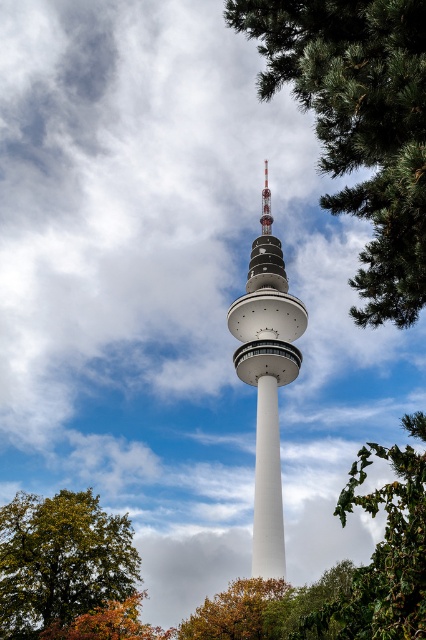
You are standing in front of the white smooth tower at center and want to find the green leafy tree at lower left. In which direction should you look?

The green leafy tree at lower left is to the left of the white smooth tower at center, so you should look to your left to find it.

You are an architect designing a new park layout. You have to place a bench between the white smooth tower at center and the autumn leaves at lower center. Which object should the bench be closer to if it needs to be placed near the wider object?

The bench should be placed closer to the autumn leaves at lower center because the white smooth tower at center is thinner than autumn leaves at lower center, making the autumn leaves the wider object.

You are standing in front of the white smooth tower at center and want to take a photo of the green leafy tree at lower left without the tower blocking the view. Is it possible to do so given their heights?

The green leafy tree at lower left is shorter than the white smooth tower at center, so if you move far enough away from the tower, you might be able to frame the shot so that the tree is visible without the tower blocking it, but the height difference alone doesn